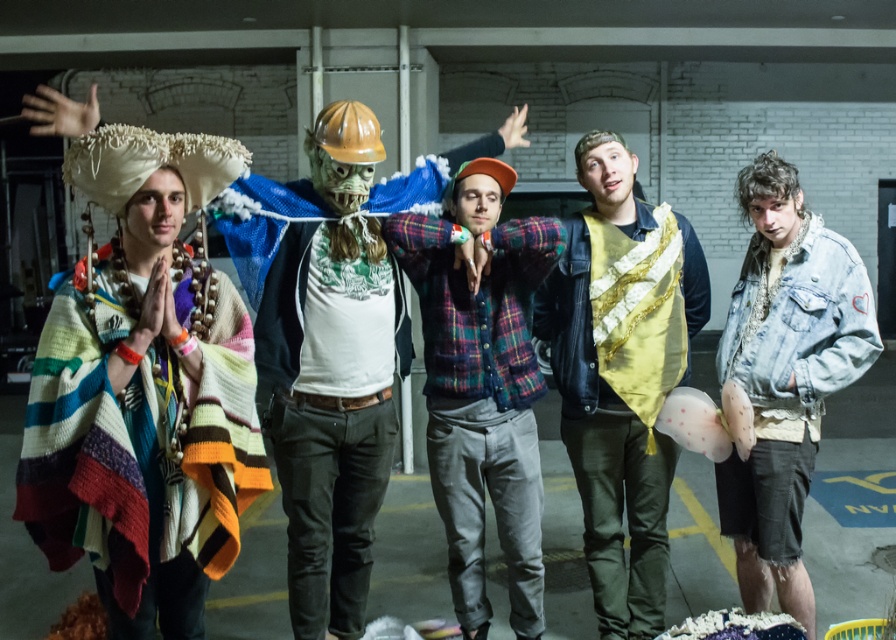
You are a delivery robot with a 1.2 meter wide package. You need to navigate between the hard plastic mask at center and the denim jacket at lower right. Can you fit through the space between them?

The space between the hard plastic mask at center and the denim jacket at lower right is 1.18 meters. Since your package is 1.2 meters wide, it is slightly too wide to fit through the available space.

Consider the image. You are a costume designer preparing for a play and need to place the hard plastic mask at center and the denim jacket at lower right on a display rack. According to the scene, which item should be placed to the left side of the rack?

The hard plastic mask at center should be placed to the left side of the rack because it is to the left of the denim jacket at lower right in the scene.

Which object is closer to the point located at coordinates (622, 390)?

The gold sequined vest at center is at the point (622, 390).